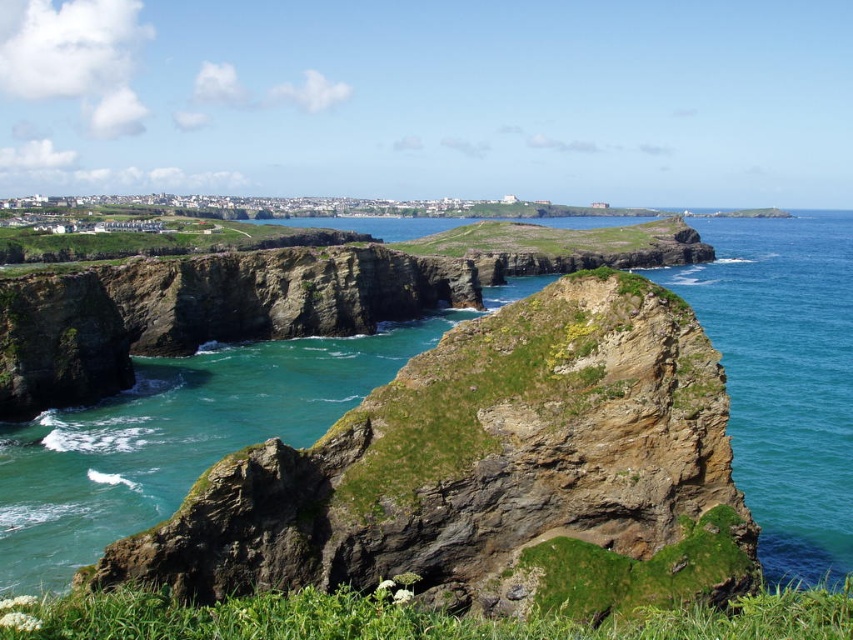
Consider the image. You are standing at the edge of the cliff and want to take a photo of the brown rocky cliff at center. If your camera can only focus on objects within a 0.1 unit radius around the point 0.74, 0.58, will the cliff be in focus?

The 2D location of brown rocky cliff at center is at point (490, 474), which is within the 0.1 unit radius around (494, 473). Therefore, the cliff will be in focus.